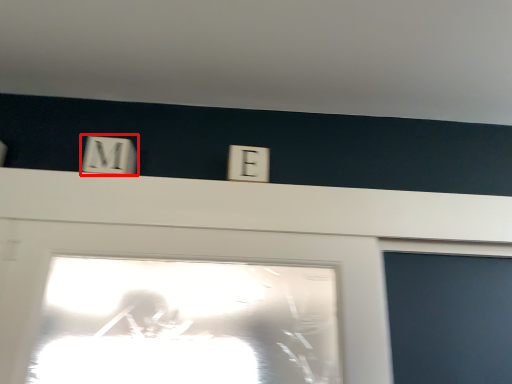
Question: From the image's perspective, considering the relative positions of light switch (annotated by the red box) and electric outlet in the image provided, where is light switch (annotated by the red box) located with respect to the staircase?

Choices:
 (A) below
 (B) above

Answer: (B)